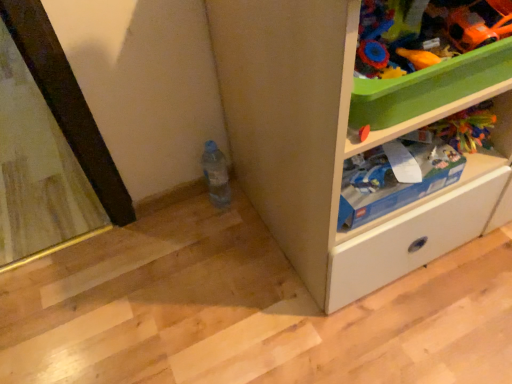
This screenshot has width=512, height=384. I want to click on free point in front of translucent plastic bottle at lower center, so click(221, 244).